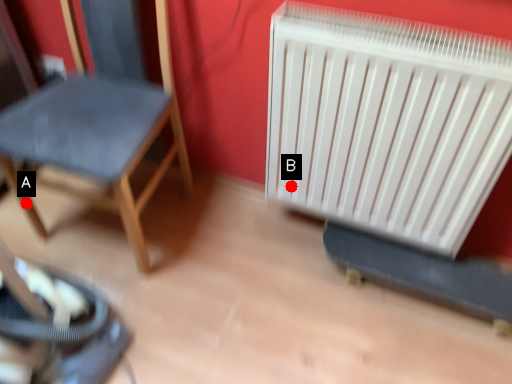
Question: Two points are circled on the image, labeled by A and B beside each circle. Among these points, which one is nearest to the camera?

Choices:
 (A) A is closer
 (B) B is closer

Answer: (B)